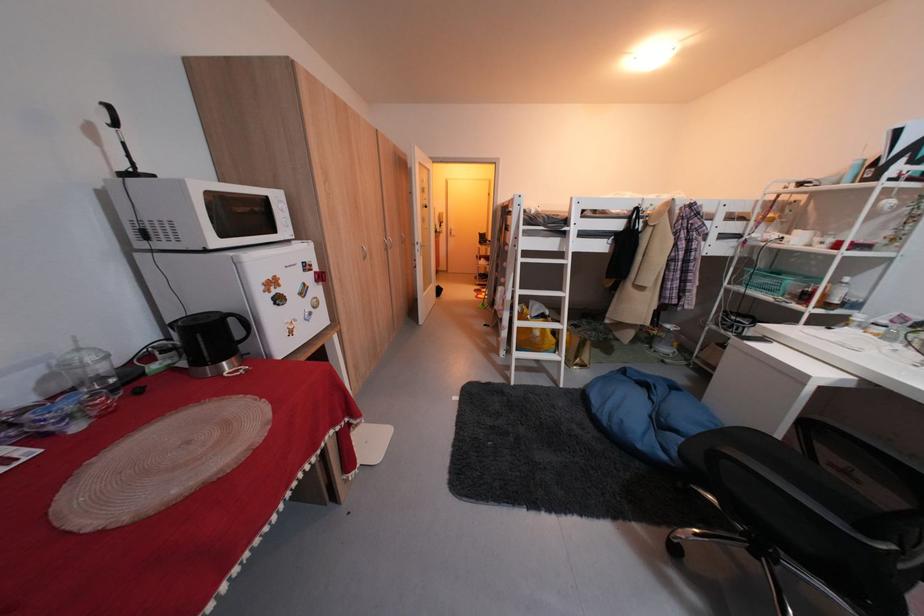
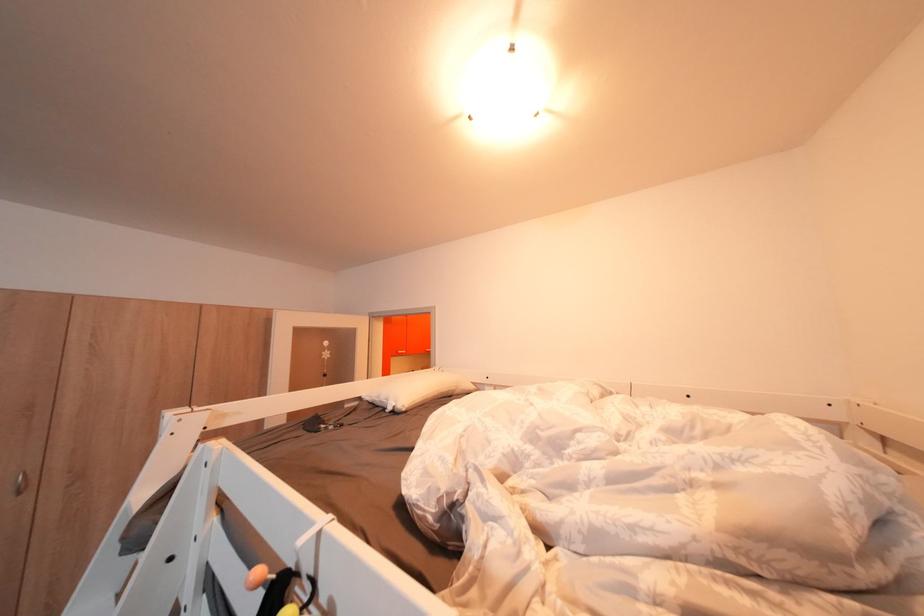
Where in the second image is the point corresponding to pixel 543 214 from the first image?

(400, 410)